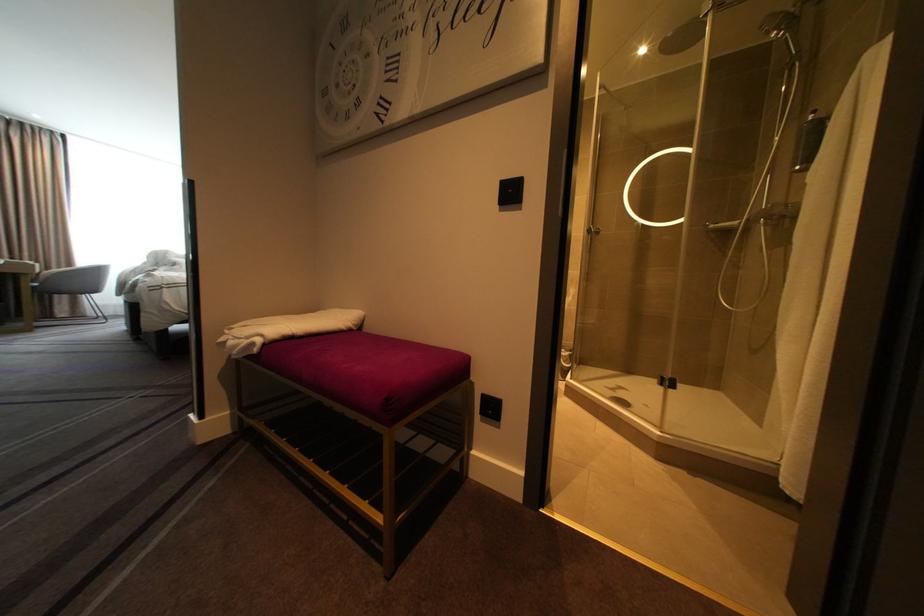
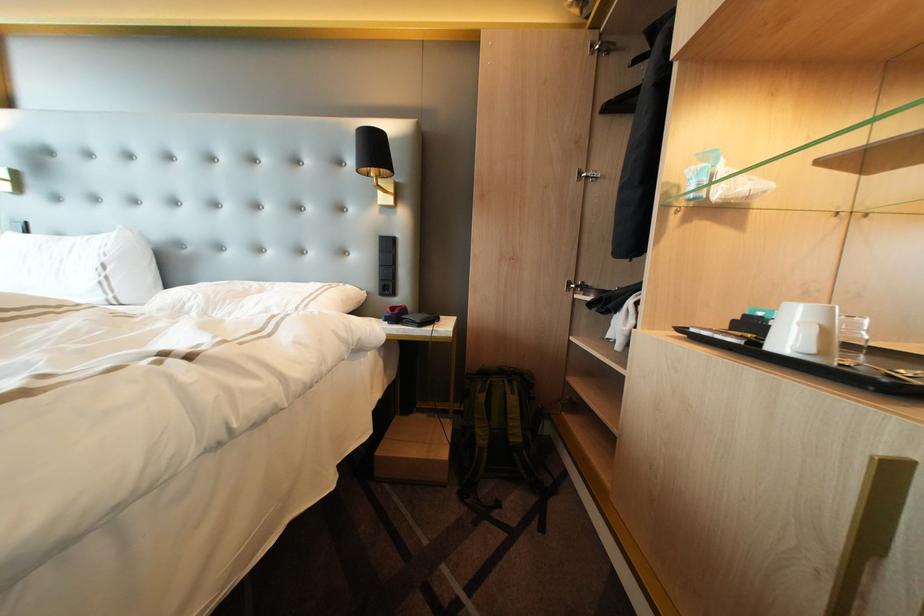
Consider the image. What movement of the cameraman would produce the second image?

The cameraman moved toward left, forward.